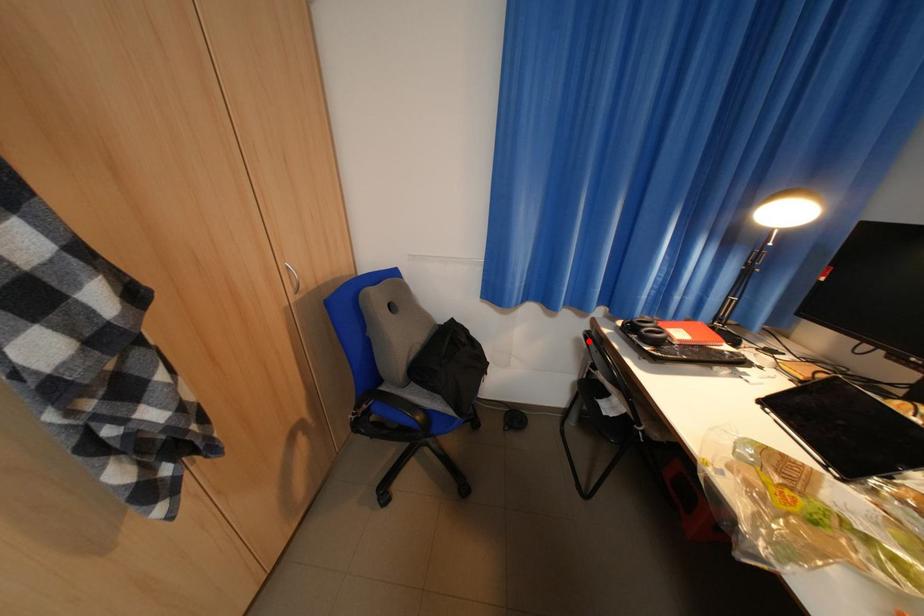
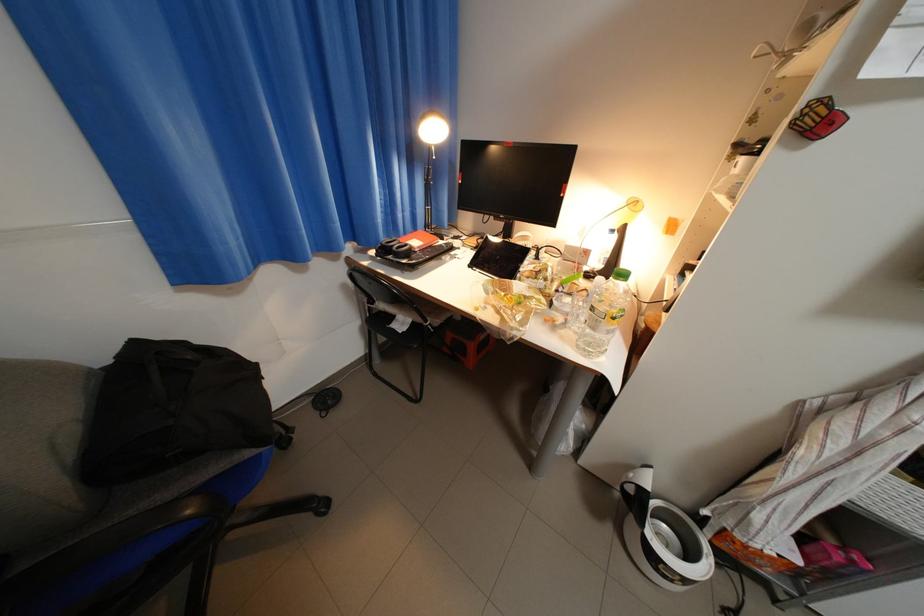
Where in the second image is the point corresponding to the highlighted location from the first image?

(355, 286)